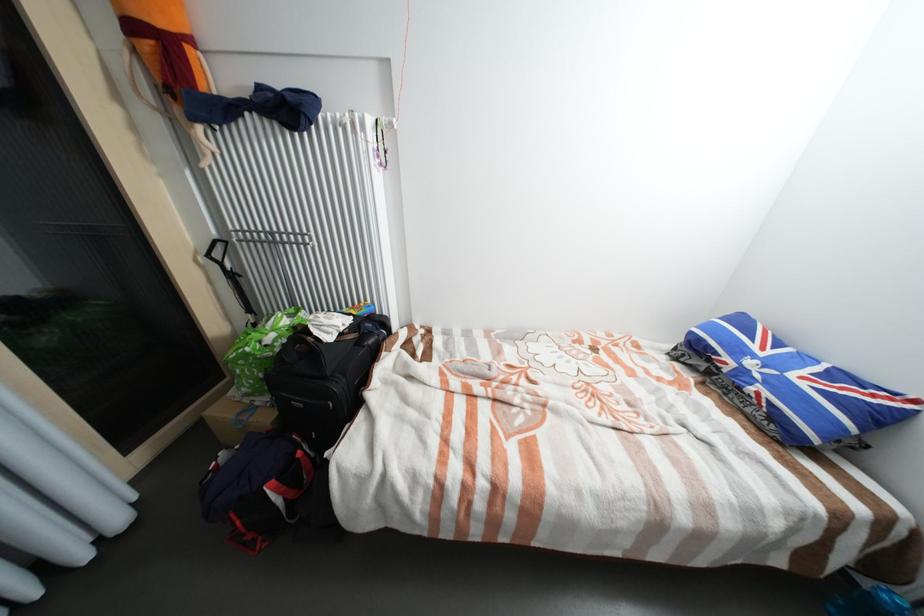
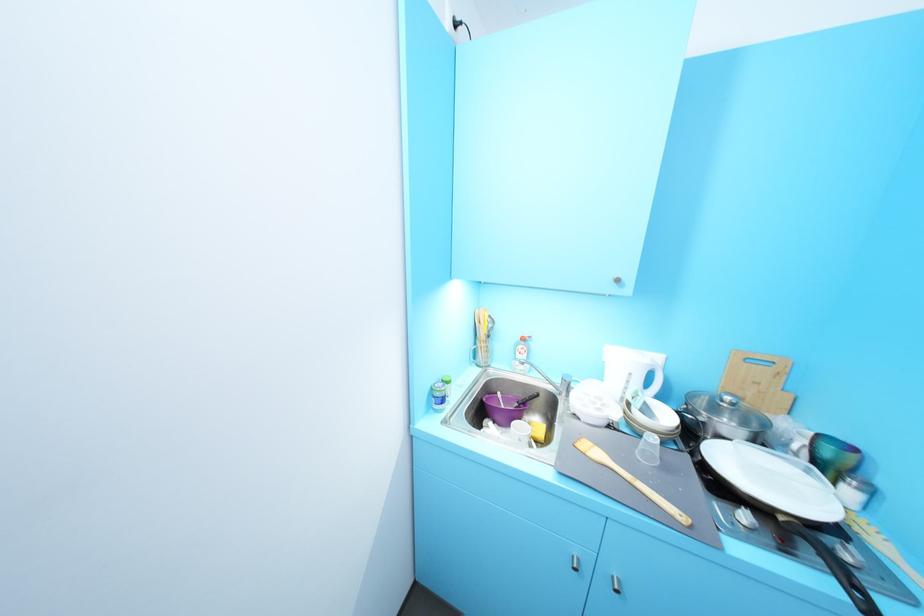
Question: I am providing you with two images of the same scene from different viewpoints. After the viewpoint changes to image2, which objects are now occluded?

Choices:
 (A) brown mug handle
 (B) wooden spatula
 (C) silver cabinet handle
 (D) green shopping bag

Answer: (D)